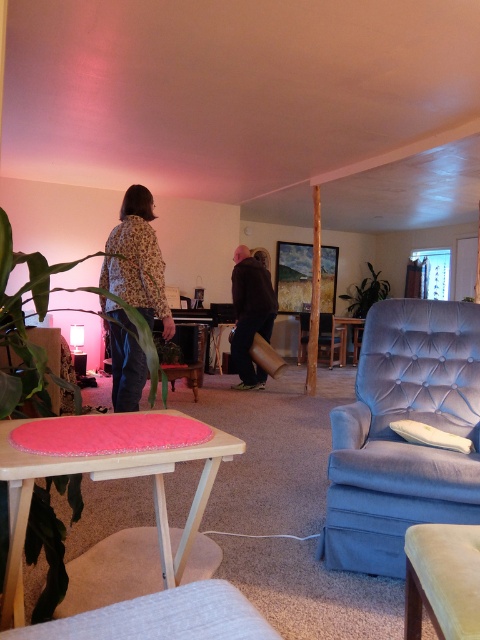
Question: Which point is closer to the camera?

Choices:
 (A) tap(358, 352)
 (B) tap(302, 332)
 (C) tap(131, 300)

Answer: (C)

Question: Is pink felt table at lower left bigger than floral-patterned shirt at left?

Choices:
 (A) yes
 (B) no

Answer: (B)

Question: Considering the relative positions of pink felt table at lower left and pink felt table at center in the image provided, where is pink felt table at lower left located with respect to pink felt table at center?

Choices:
 (A) right
 (B) left

Answer: (B)

Question: Does floral-patterned shirt at left appear over green plastic stool at center?

Choices:
 (A) yes
 (B) no

Answer: (A)

Question: Which point is farther from the camera taking this photo?

Choices:
 (A) (137, 188)
 (B) (2, 458)

Answer: (A)

Question: Which object is the closest to the green plastic stool at center?

Choices:
 (A) velvet blue armchair at center
 (B) floral-patterned shirt at left

Answer: (B)